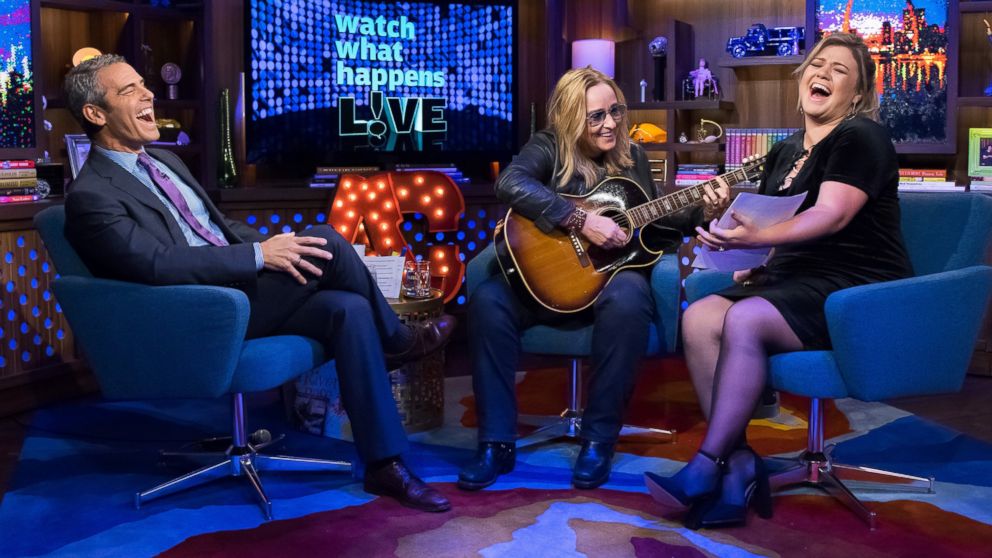
I want to click on television, so (x=302, y=62), (x=11, y=49).